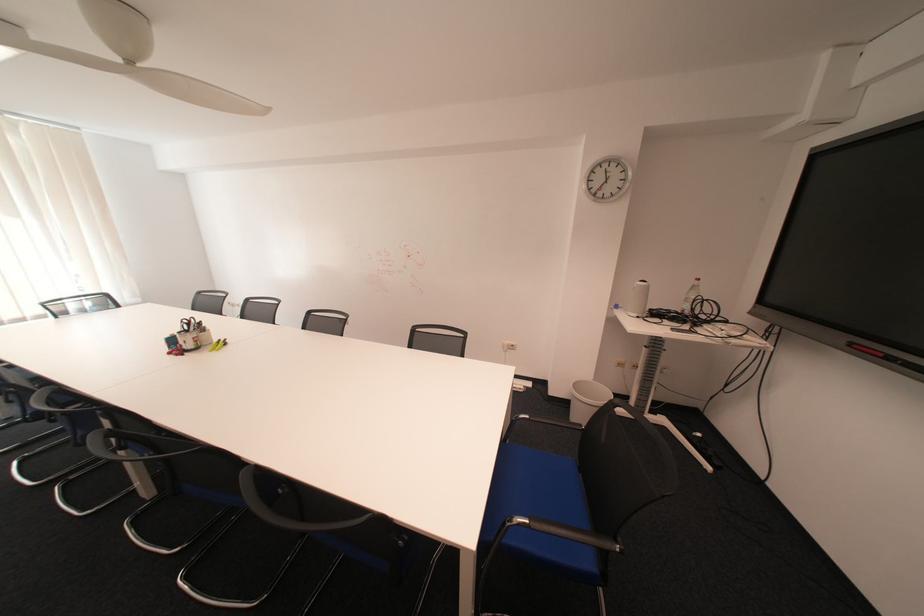
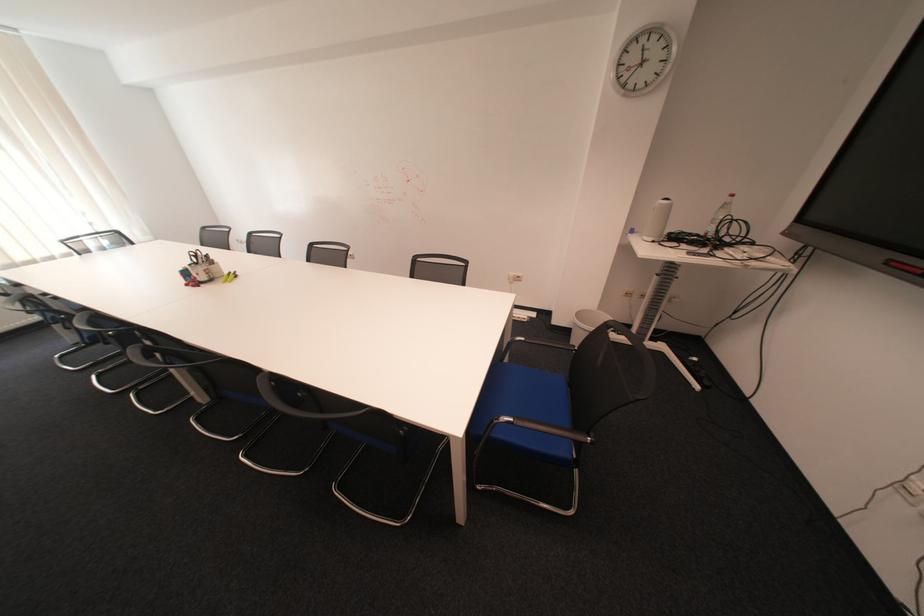
Locate, in the second image, the point that corresponds to [588,387] in the first image.

(590, 315)